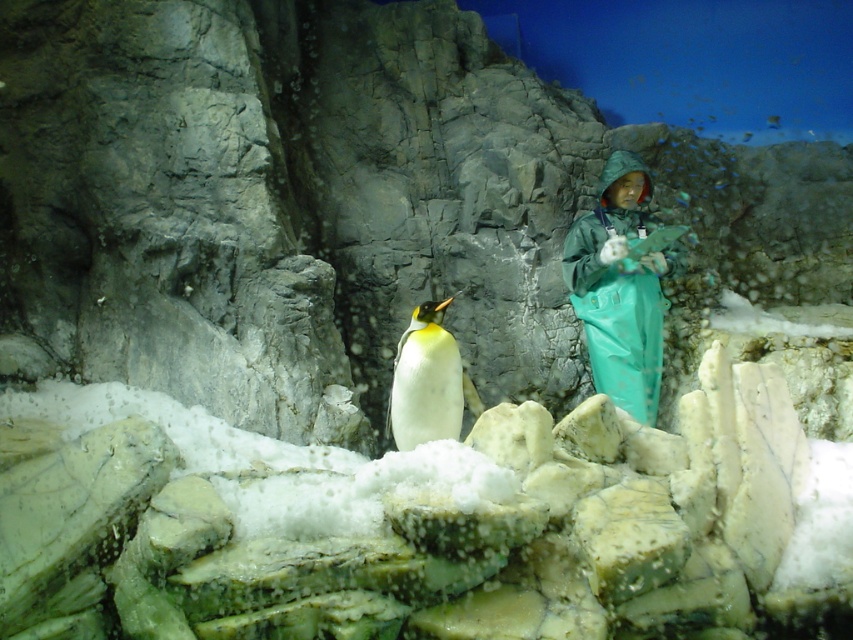
Question: Which of the following is the closest to the observer?

Choices:
 (A) (589, 236)
 (B) (428, 394)

Answer: (B)

Question: Observing the image, what is the correct spatial positioning of green rubber suit at center in reference to white matte penguin at center?

Choices:
 (A) below
 (B) above

Answer: (B)

Question: Which of the following is the farthest from the observer?

Choices:
 (A) (456, 410)
 (B) (606, 326)

Answer: (B)

Question: Can you confirm if green rubber suit at center is positioned to the left of white matte penguin at center?

Choices:
 (A) no
 (B) yes

Answer: (A)

Question: Can you confirm if green rubber suit at center is positioned to the left of white matte penguin at center?

Choices:
 (A) yes
 (B) no

Answer: (B)